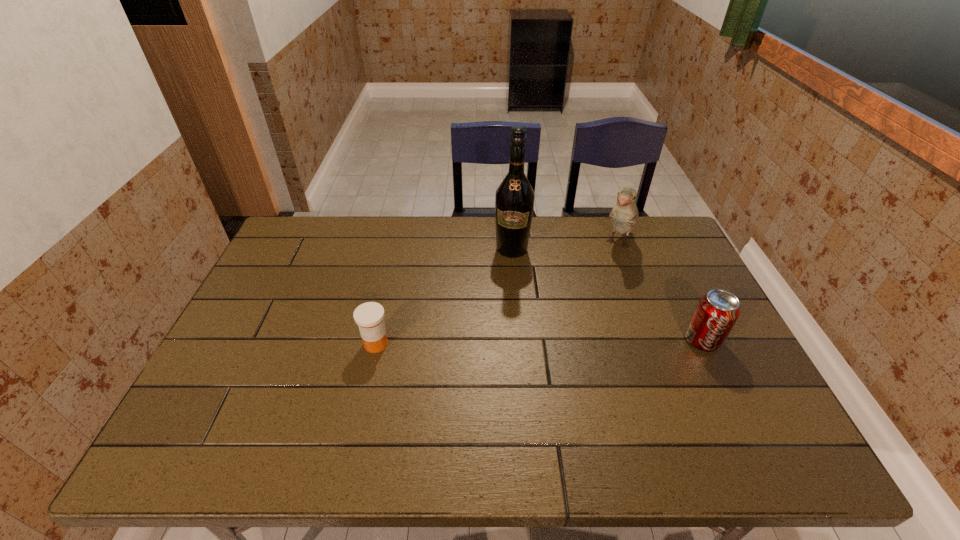
Locate an element on the screen. the shortest object is located at coordinates (369, 316).

This screenshot has width=960, height=540. I want to click on the leftmost object, so click(369, 316).

The width and height of the screenshot is (960, 540). I want to click on the second shortest object, so click(x=717, y=311).

The width and height of the screenshot is (960, 540). I want to click on the rightmost object, so click(717, 311).

Where is `the second tallest object`? the second tallest object is located at coordinates (624, 215).

Where is `the second object from right to left`? the second object from right to left is located at coordinates (624, 215).

Where is `wine bottle`? Image resolution: width=960 pixels, height=540 pixels. wine bottle is located at coordinates (514, 201).

At what (x,y) coordinates should I click in order to perform the action: click on the tallest object. Please return your answer as a coordinate pair (x, y). The image size is (960, 540). Looking at the image, I should click on (514, 201).

Find the location of a particular element. This screenshot has height=540, width=960. free location located 0.060m on the label of the shortest object is located at coordinates (370, 374).

Find the location of a particular element. vacant space located 0.230m on the left of the second shortest object is located at coordinates (598, 341).